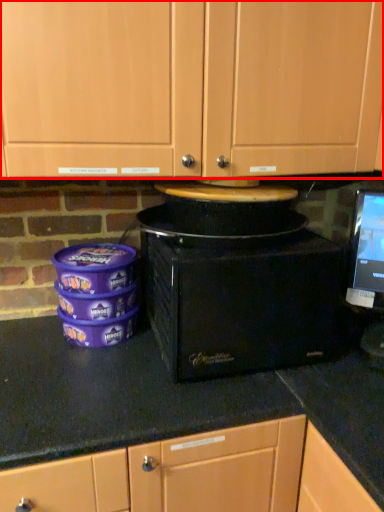
Question: From the image's perspective, considering the relative positions of cabinetry (annotated by the red box) and home appliance in the image provided, where is cabinetry (annotated by the red box) located with respect to the staircase?

Choices:
 (A) above
 (B) below

Answer: (A)